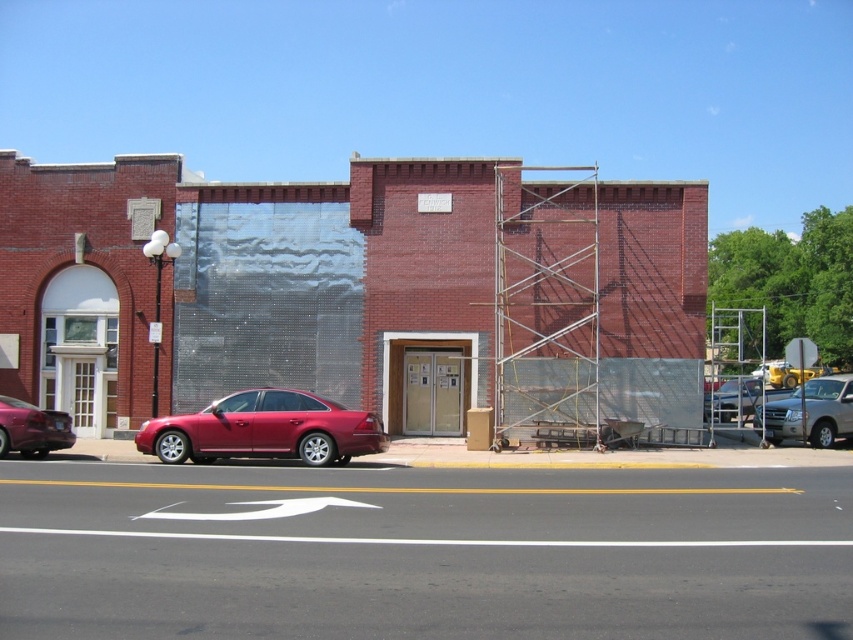
Can you confirm if brick building at center is bigger than metallic silver sedan at right?

Indeed, brick building at center has a larger size compared to metallic silver sedan at right.

Can you confirm if brick building at center is positioned to the right of metallic silver sedan at right?

In fact, brick building at center is to the left of metallic silver sedan at right.

Which is behind, point (602, 220) or point (769, 390)?

Positioned behind is point (769, 390).

Find the location of `brick building at center`. brick building at center is located at coordinates (355, 292).

Looking at this image, can you confirm if brick building at center is positioned below metallic silver truck at center?

Incorrect, brick building at center is not positioned below metallic silver truck at center.

Who is taller, brick building at center or metallic silver truck at center?

brick building at center is taller.

Is point (219, 253) farther from viewer compared to point (811, 396)?

That is False.

Locate an element on the screen. The image size is (853, 640). brick building at center is located at coordinates (355, 292).

Between metallic scaffolding at right and metallic silver sedan at right, which one has more height?

metallic scaffolding at right is taller.

Is point (518, 349) closer to viewer compared to point (706, 394)?

Yes, it is in front of point (706, 394).

At what (x,y) coordinates should I click in order to perform the action: click on metallic scaffolding at right. Please return your answer as a coordinate pair (x, y). The height and width of the screenshot is (640, 853). Looking at the image, I should click on (546, 305).